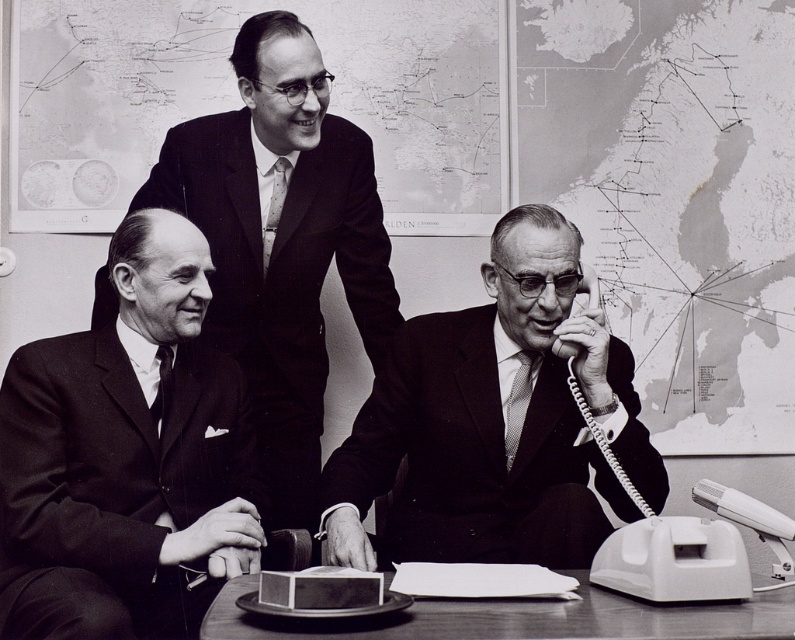
Question: Based on their relative distances, which object is farther from the matte black suit at left?

Choices:
 (A) matte black suit at upper center
 (B) smooth wooden table at lower center
 (C) matte black suit at center

Answer: (B)

Question: Among these objects, which one is nearest to the camera?

Choices:
 (A) matte black suit at left
 (B) smooth wooden table at lower center
 (C) matte black suit at center

Answer: (B)

Question: Based on their relative distances, which object is nearer to the matte black suit at center?

Choices:
 (A) matte black suit at left
 (B) matte black suit at upper center
 (C) smooth wooden table at lower center

Answer: (C)

Question: Can you confirm if matte black suit at center is positioned below smooth wooden table at lower center?

Choices:
 (A) yes
 (B) no

Answer: (B)

Question: Is matte black suit at left to the right of matte black suit at upper center from the viewer's perspective?

Choices:
 (A) no
 (B) yes

Answer: (A)

Question: Is matte black suit at center to the left of smooth wooden table at lower center from the viewer's perspective?

Choices:
 (A) yes
 (B) no

Answer: (B)